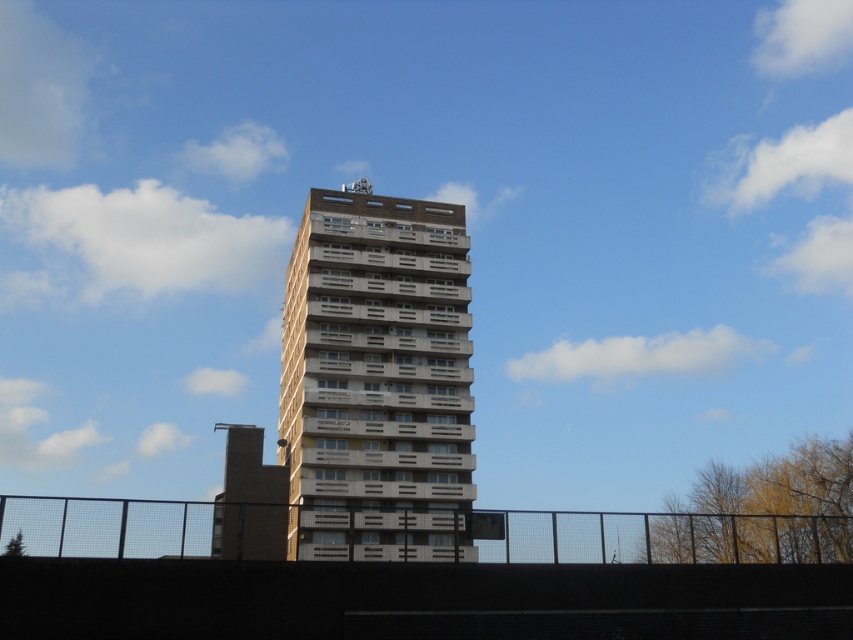
You are standing in front of the beige concrete tower block at center and the black metal fence at lower center. Which object is taller?

The beige concrete tower block at center is taller than the black metal fence at lower center.

You are standing in front of the beige concrete tower block at center and the black metal fence at lower center. Which object appears larger in the image?

The beige concrete tower block at center appears larger than the black metal fence at lower center because it is bigger in size according to the description.